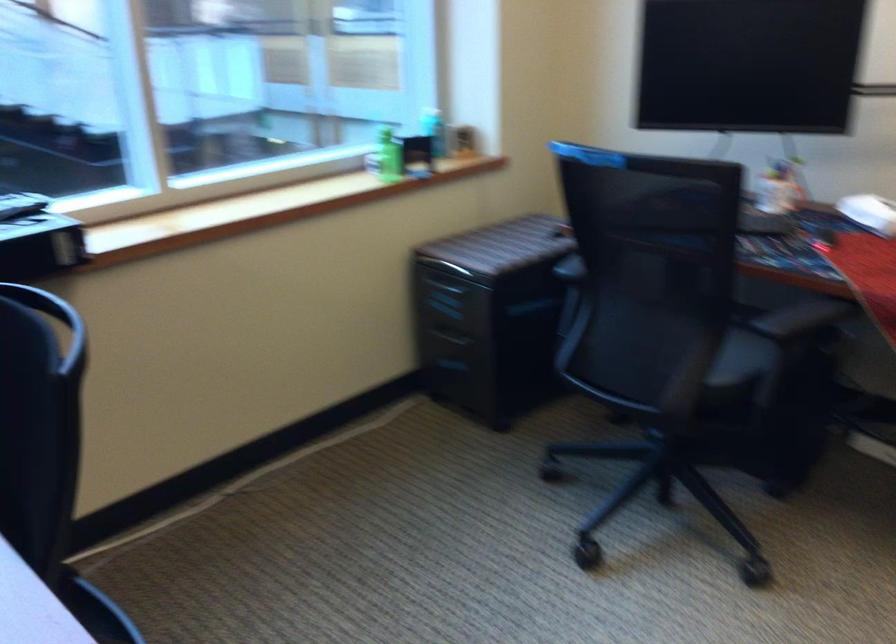
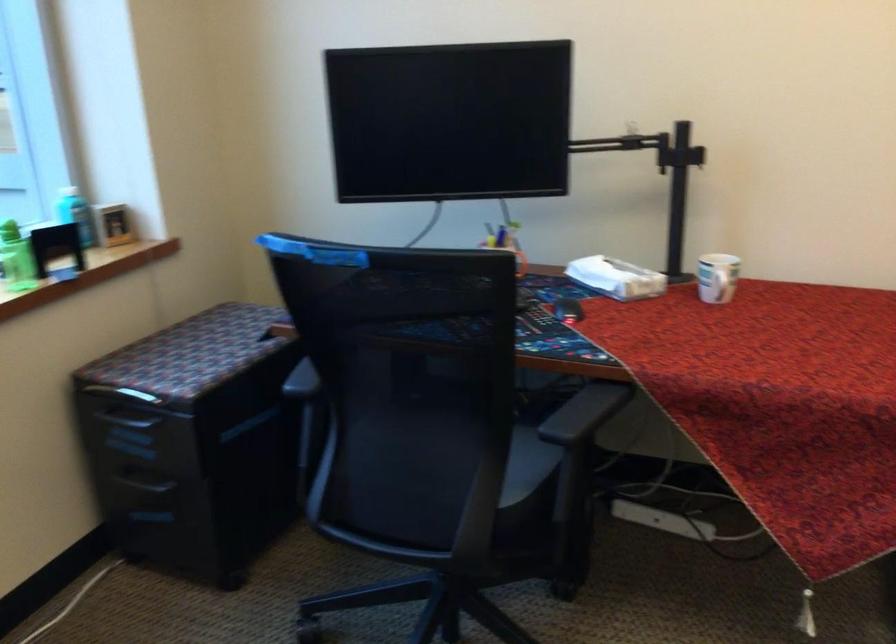
Where in the second image is the point corresponding to (814,232) from the first image?

(567, 308)